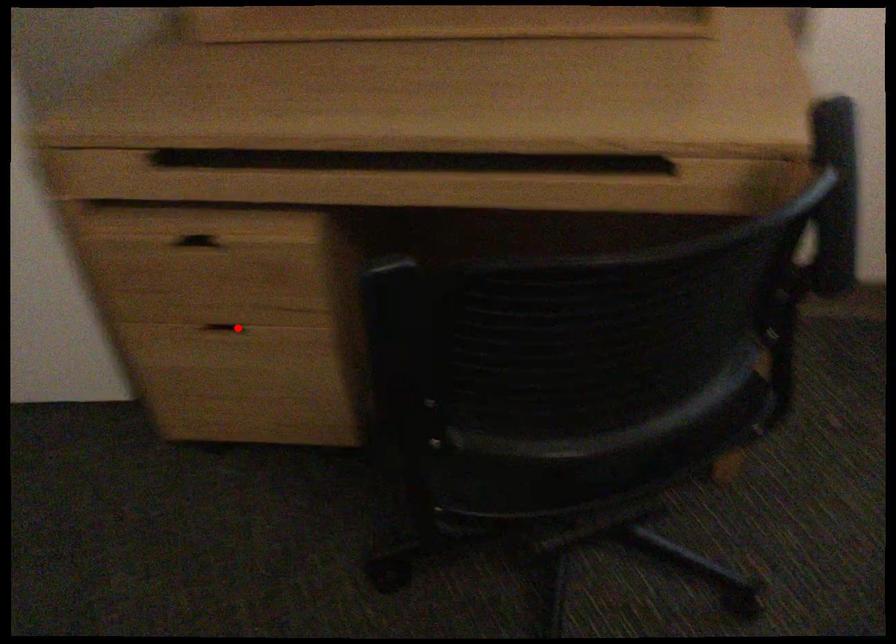
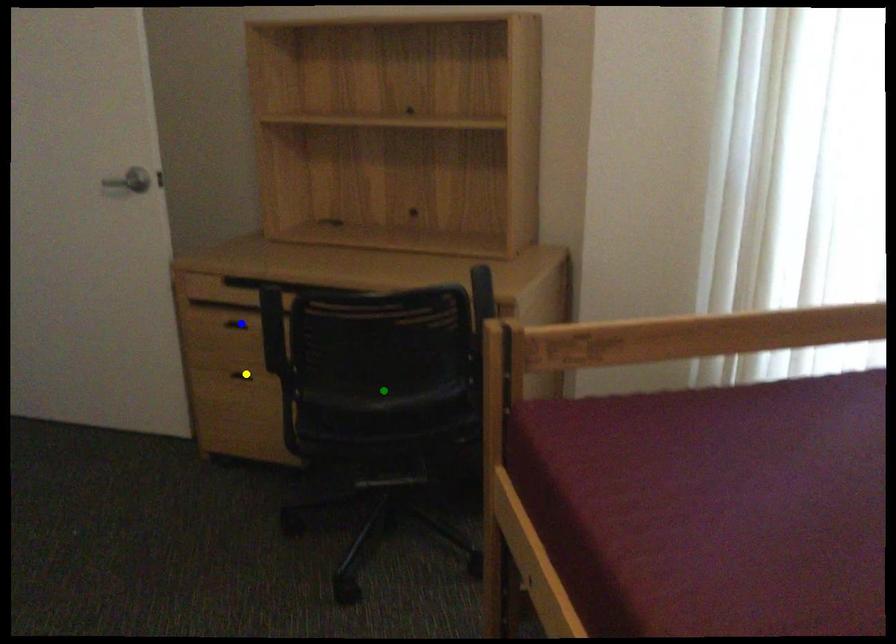
Question: I am providing you with two images of the same scene from different viewpoints. A red point is marked on the first image. You are given multiple points on the second image. Which mark in image 2 goes with the point in image 1?

Choices:
 (A) green point
 (B) yellow point
 (C) blue point

Answer: (B)